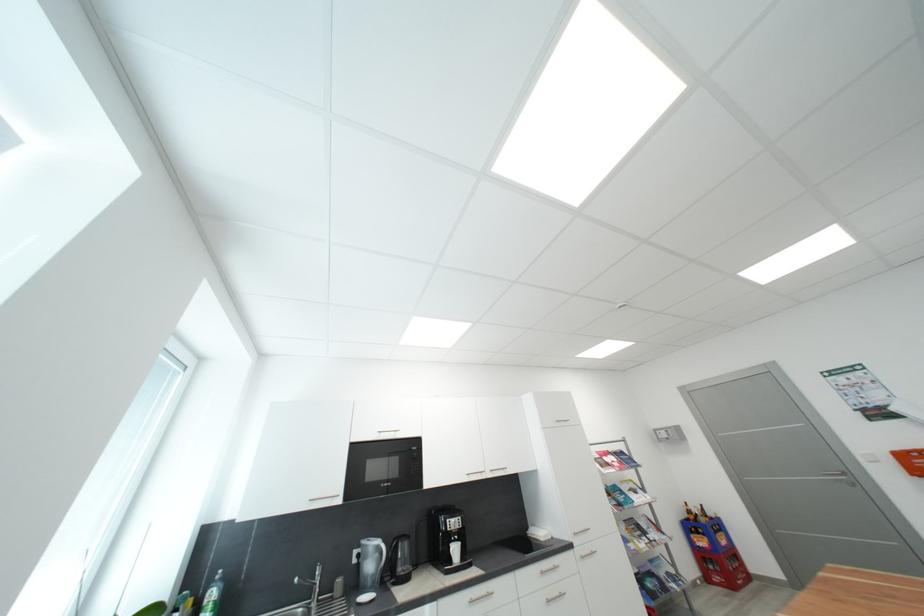
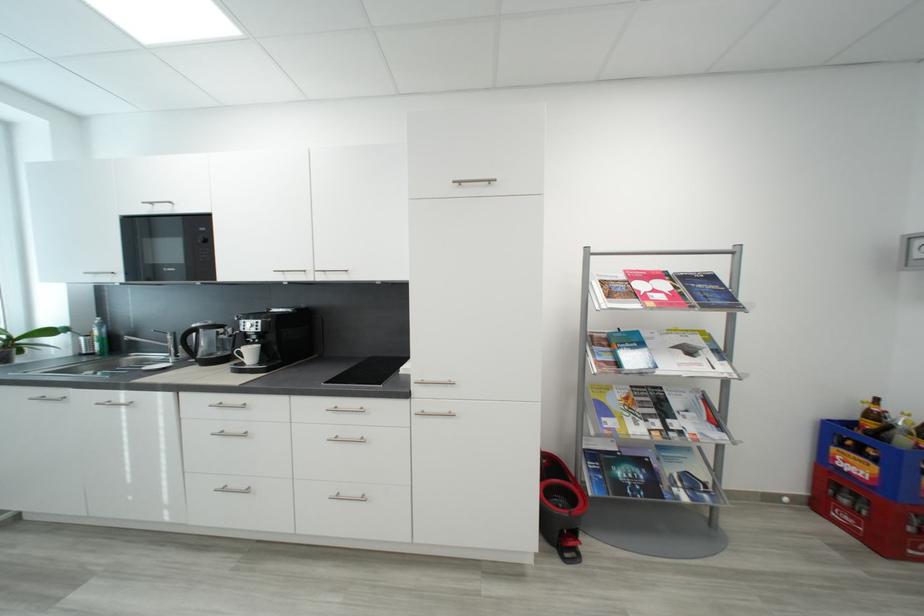
Where in the second image is the point corresponding to point 550,575 from the first image?

(343, 411)